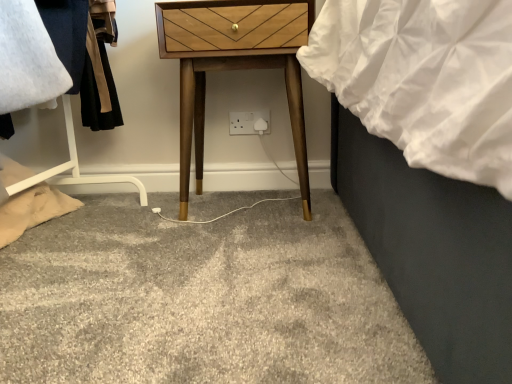
Question: Is woodenmaterial/texturenightstand at center looking in the opposite direction of white plastic socket at center?

Choices:
 (A) no
 (B) yes

Answer: (B)

Question: From a real-world perspective, is woodenmaterial/texturenightstand at center positioned under white plastic socket at center based on gravity?

Choices:
 (A) yes
 (B) no

Answer: (B)

Question: Does woodenmaterial/texturenightstand at center appear on the right side of white plastic socket at center?

Choices:
 (A) no
 (B) yes

Answer: (A)

Question: Is woodenmaterial/texturenightstand at center far away from white plastic socket at center?

Choices:
 (A) yes
 (B) no

Answer: (B)

Question: Is woodenmaterial/texturenightstand at center next to white plastic socket at center and touching it?

Choices:
 (A) yes
 (B) no

Answer: (B)

Question: Does woodenmaterial/texturenightstand at center turn towards white plastic socket at center?

Choices:
 (A) yes
 (B) no

Answer: (A)

Question: Does white plastic socket at center have a lesser width compared to woodenmaterial/texturenightstand at center?

Choices:
 (A) no
 (B) yes

Answer: (B)

Question: Considering the relative sizes of white plastic socket at center and woodenmaterial/texturenightstand at center in the image provided, is white plastic socket at center smaller than woodenmaterial/texturenightstand at center?

Choices:
 (A) yes
 (B) no

Answer: (A)

Question: Is white plastic socket at center completely or partially outside of woodenmaterial/texturenightstand at center?

Choices:
 (A) no
 (B) yes

Answer: (B)

Question: Is white plastic socket at center in front of woodenmaterial/texturenightstand at center?

Choices:
 (A) yes
 (B) no

Answer: (B)

Question: Can you confirm if white plastic socket at center is positioned to the right of woodenmaterial/texturenightstand at center?

Choices:
 (A) yes
 (B) no

Answer: (A)

Question: Is white plastic socket at center not close to woodenmaterial/texturenightstand at center?

Choices:
 (A) yes
 (B) no

Answer: (B)

Question: In the image, is woodenmaterial/texturenightstand at center positioned in front of or behind white plastic socket at center?

Choices:
 (A) front
 (B) behind

Answer: (A)